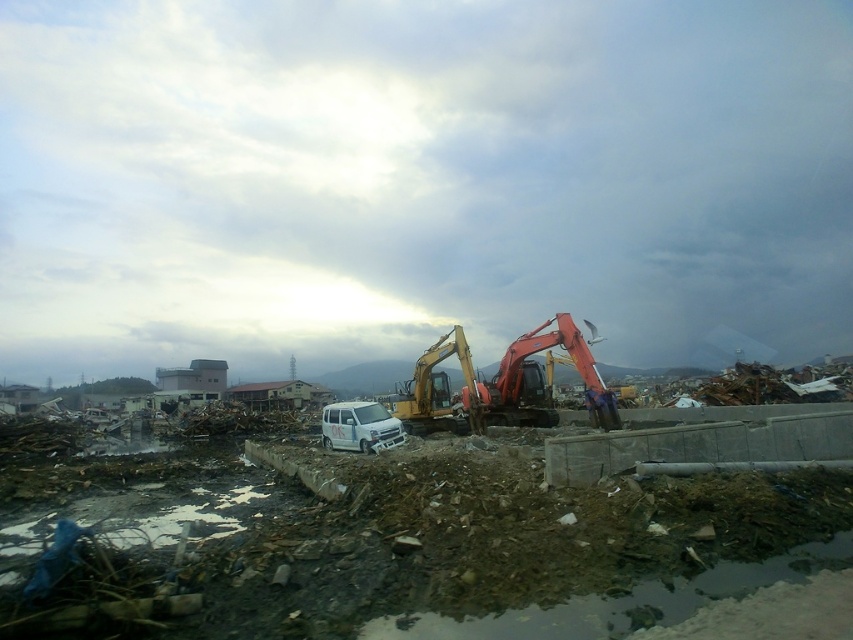
You are a construction worker standing near the debris in the foreground. You need to move a heavy object from the foreground to the background. Which excavator, the metallic yellow excavator at center or the orange metallic excavator at center, should you use if you want to work with the one that is closer to your current position?

You should use the metallic yellow excavator at center because it is closer to the viewer than the orange metallic excavator at center, making it more accessible from your current position near the debris in the foreground.

You are a construction worker who needs to move a heavy object from the right side of the orange metallic excavator at center to the left side of the metallic yellow excavator at center. Can you do this without moving either excavator?

The metallic yellow excavator at center is already positioned to the left of the orange metallic excavator at center, so the heavy object can be moved from the right side of the orange excavator to the left side of the yellow excavator without needing to move either machine.

You are a construction worker who needs to move a heavy beam from the metallic yellow excavator at center to the orange metallic excavator at center. The beam is 6 meters long. Can the excavators safely pass the beam between them without needing to move closer?

The distance between the metallic yellow excavator at center and the orange metallic excavator at center is 6.31 meters. Since the beam is 6 meters long, it can be safely passed between them without requiring the excavators to move closer.